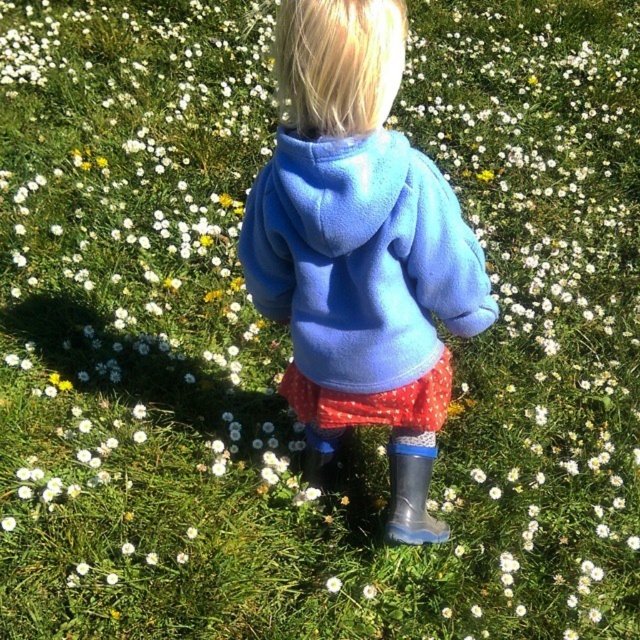
Does blue fleece hoodie at center have a lesser height compared to matte blue sweatshirt at center?

No, blue fleece hoodie at center is not shorter than matte blue sweatshirt at center.

Which is in front, point (348, 291) or point (253, 193)?

Positioned in front is point (348, 291).

Who is more distant from viewer, (310, 200) or (349, 324)?

Point (349, 324)

Locate an element on the screen. blue fleece hoodie at center is located at coordinates (358, 250).

Does blue fleece hoodie at center have a smaller size compared to transparent rubber boot at lower right?

Incorrect, blue fleece hoodie at center is not smaller in size than transparent rubber boot at lower right.

Does blue fleece hoodie at center have a larger size compared to transparent rubber boot at lower right?

Correct, blue fleece hoodie at center is larger in size than transparent rubber boot at lower right.

You are a GUI agent. You are given a task and a screenshot of the screen. Output one action in this format:
    pyautogui.click(x=<x>, y=<y>)
    Task: Click on the blue fleece hoodie at center
    This screenshot has width=640, height=640.
    Given the screenshot: What is the action you would take?
    pyautogui.click(x=358, y=250)

Does transparent rubber boot at lower right have a lesser height compared to white fluffy flower at center?

No, transparent rubber boot at lower right is not shorter than white fluffy flower at center.

Does transparent rubber boot at lower right come in front of white fluffy flower at center?

Yes, it is.

This screenshot has height=640, width=640. What do you see at coordinates (412, 496) in the screenshot?
I see `transparent rubber boot at lower right` at bounding box center [412, 496].

This screenshot has height=640, width=640. In order to click on transparent rubber boot at lower right in this screenshot , I will do `click(412, 496)`.